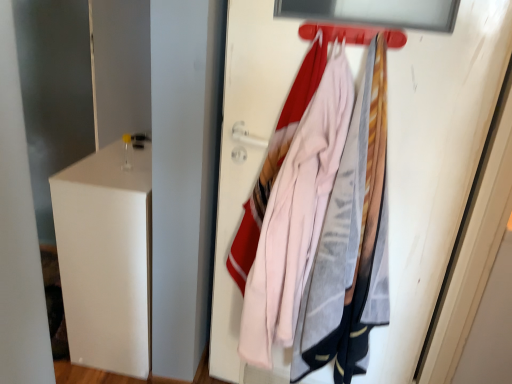
Measure the distance between point [59,247] and camera.

4.88 feet.

Describe the element at coordinates (296, 216) in the screenshot. Image resolution: width=512 pixels, height=384 pixels. I see `pink fabric coat at center` at that location.

Describe the element at coordinates (351, 34) in the screenshot. Image resolution: width=512 pixels, height=384 pixels. I see `metallic red hanger at upper center` at that location.

Describe the element at coordinates (433, 166) in the screenshot. I see `pink fabric at upper right` at that location.

Identify the location of white matte file cabinet at left. (106, 257).

Which is behind, point (391, 36) or point (131, 368)?

The point (131, 368) is farther.

Is metallic red hanger at upper center far away from white matte file cabinet at left?

No, metallic red hanger at upper center is not far away from white matte file cabinet at left.

How many degrees apart are the facing directions of metallic red hanger at upper center and white matte file cabinet at left?

There is a 84.8-degree angle between the facing directions of metallic red hanger at upper center and white matte file cabinet at left.

From a real-world perspective, does metallic red hanger at upper center sit lower than white matte file cabinet at left?

No, from a real-world perspective, metallic red hanger at upper center is not under white matte file cabinet at left.

Does pink fabric at upper right have a lesser width compared to metallic red hanger at upper center?

Yes, pink fabric at upper right is thinner than metallic red hanger at upper center.

I want to click on hanger that appears above the pink fabric at upper right (from a real-world perspective), so click(x=351, y=34).

Between pink fabric at upper right and metallic red hanger at upper center, which one has smaller size?

metallic red hanger at upper center.

From the picture: From the image's perspective, is pink fabric at upper right above metallic red hanger at upper center?

No.

From a real-world perspective, is pink fabric at upper right on white matte file cabinet at left?

Yes.

Looking at this image, is pink fabric at upper right touching white matte file cabinet at left?

No, pink fabric at upper right is not next to white matte file cabinet at left.

Which is behind, pink fabric at upper right or white matte file cabinet at left?

white matte file cabinet at left is more distant.

Is point (402, 108) more distant than point (104, 337)?

No, it is in front of (104, 337).

Does pink fabric coat at center contain metallic red hanger at upper center?

Definitely not — metallic red hanger at upper center is not inside pink fabric coat at center.

Can you tell me how much pink fabric coat at center and metallic red hanger at upper center differ in facing direction?

0.000405 degrees.

Which object is positioned more to the left, pink fabric coat at center or metallic red hanger at upper center?

pink fabric coat at center.

Is pink fabric coat at center in front of or behind metallic red hanger at upper center in the image?

In the image, pink fabric coat at center appears behind metallic red hanger at upper center.

Considering the sizes of objects metallic red hanger at upper center and pink fabric coat at center in the image provided, who is taller, metallic red hanger at upper center or pink fabric coat at center?

With more height is pink fabric coat at center.

Is metallic red hanger at upper center oriented away from pink fabric coat at center?

That's not correct — metallic red hanger at upper center is not looking away from pink fabric coat at center.

Relative to pink fabric coat at center, is metallic red hanger at upper center in front or behind?

Clearly, metallic red hanger at upper center is in front of pink fabric coat at center.

Which is more to the right, metallic red hanger at upper center or pink fabric coat at center?

From the viewer's perspective, metallic red hanger at upper center appears more on the right side.

Which is correct: metallic red hanger at upper center is inside pink fabric at upper right, or outside of it?

metallic red hanger at upper center is spatially situated outside pink fabric at upper right.

Locate an element on the screen. The image size is (512, 384). door on the left of metallic red hanger at upper center is located at coordinates (433, 166).

Is metallic red hanger at upper center next to pink fabric at upper right and touching it?

No.

Considering the points (367, 34) and (249, 38), which point is behind, point (367, 34) or point (249, 38)?

The point (249, 38) is farther.

Is pink fabric coat at center with white matte file cabinet at left?

No, pink fabric coat at center is not making contact with white matte file cabinet at left.

Is pink fabric coat at center further to camera compared to white matte file cabinet at left?

No, pink fabric coat at center is closer to the viewer.

From the image's perspective, is pink fabric coat at center below white matte file cabinet at left?

Incorrect, from the image's perspective, pink fabric coat at center is higher than white matte file cabinet at left.

From the picture: Can you tell me how much pink fabric coat at center and white matte file cabinet at left differ in facing direction?

84.8 degrees separate the facing orientations of pink fabric coat at center and white matte file cabinet at left.

Where is `file cabinet lying behind the metallic red hanger at upper center`? This screenshot has width=512, height=384. file cabinet lying behind the metallic red hanger at upper center is located at coordinates (106, 257).

This screenshot has height=384, width=512. What are the coordinates of `door lying on the left of metallic red hanger at upper center` in the screenshot? It's located at (433, 166).

Based on their spatial positions, is pink fabric coat at center or metallic red hanger at upper center further from pink fabric at upper right?

metallic red hanger at upper center lies further to pink fabric at upper right than the other object.

Looking at the image, which one is located further to metallic red hanger at upper center, white matte file cabinet at left or pink fabric at upper right?

white matte file cabinet at left.

From the image, which object appears to be nearer to pink fabric at upper right, white matte file cabinet at left or pink fabric coat at center?

pink fabric coat at center is closer to pink fabric at upper right.

When comparing their distances from metallic red hanger at upper center, does pink fabric at upper right or white matte file cabinet at left seem closer?

pink fabric at upper right is positioned closer to the anchor metallic red hanger at upper center.

Considering their positions, is pink fabric coat at center positioned closer to white matte file cabinet at left than pink fabric at upper right?

Based on the image, pink fabric at upper right appears to be nearer to white matte file cabinet at left.

Considering their positions, is pink fabric coat at center positioned further to white matte file cabinet at left than metallic red hanger at upper center?

metallic red hanger at upper center lies further to white matte file cabinet at left than the other object.

When comparing their distances from pink fabric at upper right, does metallic red hanger at upper center or pink fabric coat at center seem closer?

Based on the image, pink fabric coat at center appears to be nearer to pink fabric at upper right.

From the image, which object appears to be farther from pink fabric coat at center, metallic red hanger at upper center or white matte file cabinet at left?

white matte file cabinet at left is positioned further to the anchor pink fabric coat at center.

You are a GUI agent. You are given a task and a screenshot of the screen. Output one action in this format:
    pyautogui.click(x=<x>, y=<y>)
    Task: Click on the clothing between metallic red hanger at upper center and pink fabric at upper right in the up-down direction
    This screenshot has width=512, height=384.
    Given the screenshot: What is the action you would take?
    pyautogui.click(x=296, y=216)

Image resolution: width=512 pixels, height=384 pixels. Find the location of `door located between white matte file cabinet at left and metallic red hanger at upper center in the left-right direction`. door located between white matte file cabinet at left and metallic red hanger at upper center in the left-right direction is located at coordinates (433, 166).

At what (x,y) coordinates should I click in order to perform the action: click on clothing situated between white matte file cabinet at left and metallic red hanger at upper center from left to right. Please return your answer as a coordinate pair (x, y). The image size is (512, 384). Looking at the image, I should click on (296, 216).

The image size is (512, 384). I want to click on clothing between white matte file cabinet at left and pink fabric at upper right, so click(296, 216).